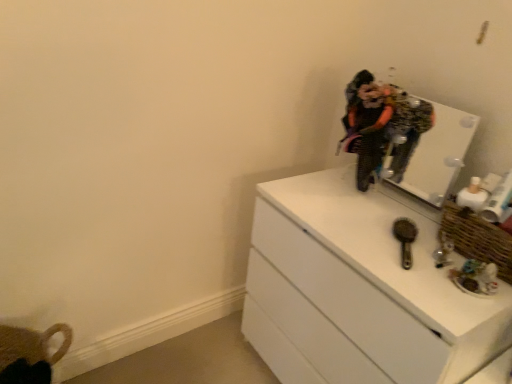
Find the location of a particular element. The height and width of the screenshot is (384, 512). free location in front of metallic brown brush at center-right is located at coordinates (422, 284).